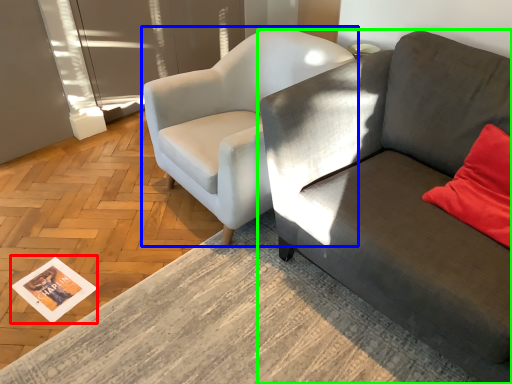
Question: Estimate the real-world distances between objects in this image. Which object is farther from magazine (highlighted by a red box), chair (highlighted by a blue box) or studio couch (highlighted by a green box)?

Choices:
 (A) chair
 (B) studio couch

Answer: (B)